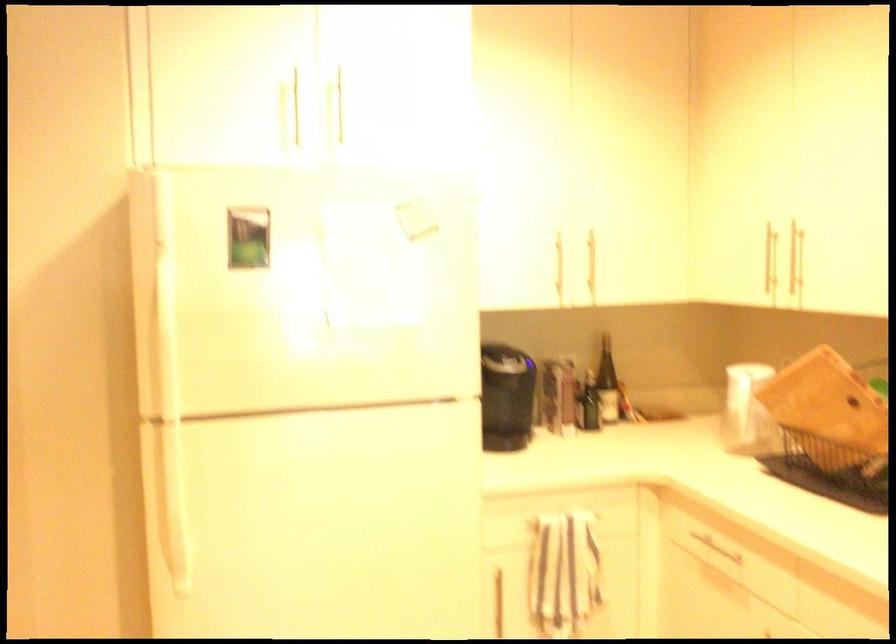
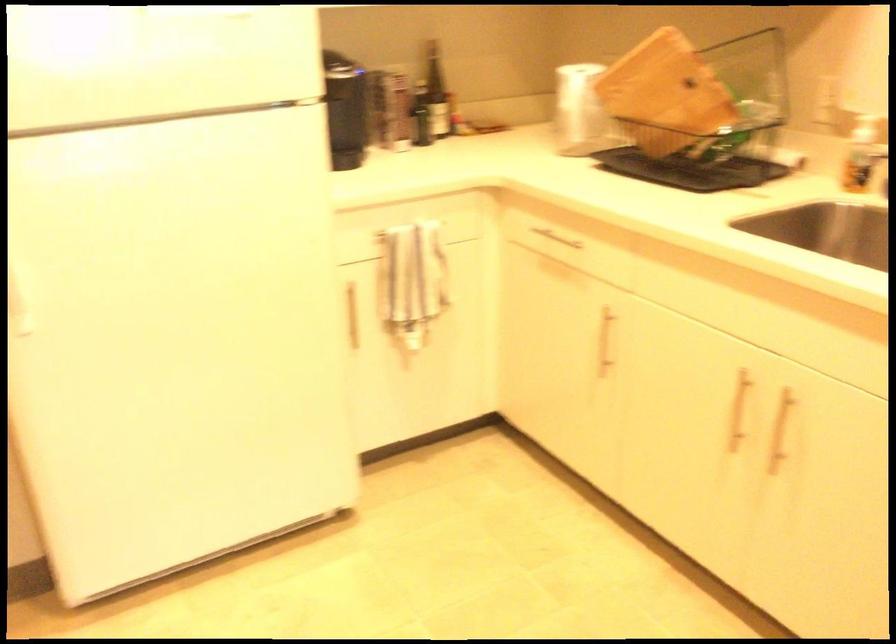
Question: What movement of the cameraman would produce the second image?

Choices:
 (A) Left
 (B) Right
 (C) Forward
 (D) Backward

Answer: (A)